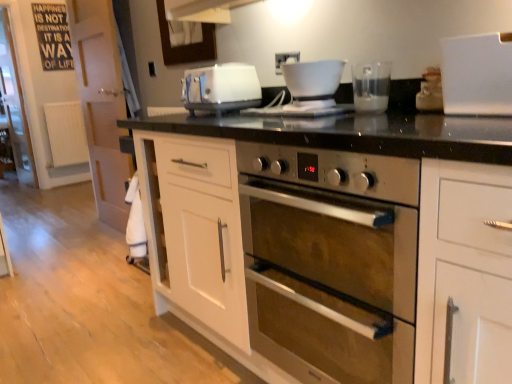
Question: Is white plastic toaster at center surrounded by white plastic electric outlet at upper center?

Choices:
 (A) yes
 (B) no

Answer: (B)

Question: Is white plastic electric outlet at upper center positioned far away from white plastic toaster at center?

Choices:
 (A) no
 (B) yes

Answer: (A)

Question: Is white plastic electric outlet at upper center positioned beyond the bounds of white plastic toaster at center?

Choices:
 (A) no
 (B) yes

Answer: (B)

Question: Considering the relative sizes of white plastic electric outlet at upper center and white plastic toaster at center in the image provided, is white plastic electric outlet at upper center taller than white plastic toaster at center?

Choices:
 (A) no
 (B) yes

Answer: (A)

Question: Does white plastic electric outlet at upper center lie behind white plastic toaster at center?

Choices:
 (A) yes
 (B) no

Answer: (A)

Question: Does white plastic electric outlet at upper center have a lesser height compared to white plastic toaster at center?

Choices:
 (A) yes
 (B) no

Answer: (A)

Question: Can white plastic container at upper right be found inside white glossy bowl at upper center, placed as the second coffee machine when sorted from right to left?

Choices:
 (A) no
 (B) yes

Answer: (A)

Question: Can you confirm if white glossy bowl at upper center, the first coffee machine positioned from the left, is taller than white plastic container at upper right?

Choices:
 (A) yes
 (B) no

Answer: (B)

Question: Is white glossy bowl at upper center, placed as the second coffee machine when sorted from right to left, aimed at white plastic container at upper right?

Choices:
 (A) yes
 (B) no

Answer: (B)

Question: Is white glossy bowl at upper center, placed as the second coffee machine when sorted from right to left, in contact with white plastic container at upper right?

Choices:
 (A) no
 (B) yes

Answer: (A)

Question: Does white glossy bowl at upper center, the first coffee machine positioned from the left, have a lesser width compared to white plastic container at upper right?

Choices:
 (A) no
 (B) yes

Answer: (A)

Question: Is there a large distance between white glossy bowl at upper center, placed as the second coffee machine when sorted from right to left, and white plastic container at upper right?

Choices:
 (A) no
 (B) yes

Answer: (A)

Question: Can you confirm if white plastic container at upper right is taller than stainless steel oven at center?

Choices:
 (A) no
 (B) yes

Answer: (A)